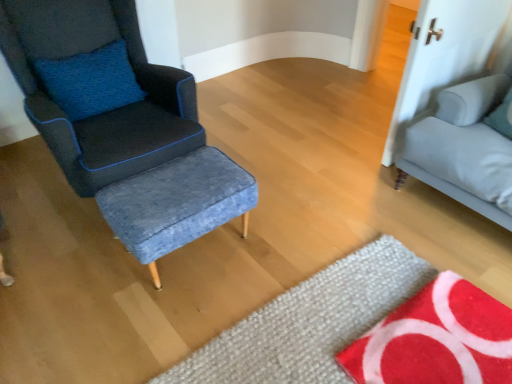
Find the location of a particular element. Image resolution: width=512 pixels, height=384 pixels. free point to the left of textured wool mat at lower center, positioned as the 2th mat in right-to-left order is located at coordinates (123, 308).